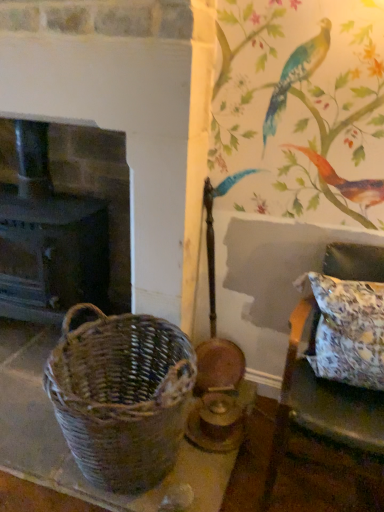
Question: Is woven brown picnic basket at left to the left of dark brown wood fireplace at left from the viewer's perspective?

Choices:
 (A) yes
 (B) no

Answer: (B)

Question: Is woven brown picnic basket at left facing away from dark brown wood fireplace at left?

Choices:
 (A) no
 (B) yes

Answer: (A)

Question: Is woven brown picnic basket at left taller than dark brown wood fireplace at left?

Choices:
 (A) yes
 (B) no

Answer: (B)

Question: Can we say woven brown picnic basket at left lies outside dark brown wood fireplace at left?

Choices:
 (A) no
 (B) yes

Answer: (B)

Question: Is woven brown picnic basket at left wider than dark brown wood fireplace at left?

Choices:
 (A) yes
 (B) no

Answer: (A)

Question: Considering the positions of point (382, 432) and point (377, 375), is point (382, 432) closer or farther from the camera than point (377, 375)?

Choices:
 (A) farther
 (B) closer

Answer: (B)

Question: From the image's perspective, is floral fabric cushion at right positioned above or below floral fabric pillow at right?

Choices:
 (A) above
 (B) below

Answer: (B)

Question: Do you think floral fabric cushion at right is within floral fabric pillow at right, or outside of it?

Choices:
 (A) outside
 (B) inside

Answer: (A)

Question: Considering their positions, is floral fabric cushion at right located in front of or behind floral fabric pillow at right?

Choices:
 (A) front
 (B) behind

Answer: (A)

Question: Considering the positions of point (112, 470) and point (261, 501), is point (112, 470) closer or farther from the camera than point (261, 501)?

Choices:
 (A) farther
 (B) closer

Answer: (B)

Question: From the image's perspective, relative to floral fabric cushion at right, is woven brown picnic basket at left above or below?

Choices:
 (A) below
 (B) above

Answer: (A)

Question: Choose the correct answer: Is woven brown picnic basket at left inside floral fabric cushion at right or outside it?

Choices:
 (A) outside
 (B) inside

Answer: (A)

Question: From a real-world perspective, is woven brown picnic basket at left physically located above or below floral fabric cushion at right?

Choices:
 (A) below
 (B) above

Answer: (A)

Question: From the image's perspective, is dark brown wood fireplace at left above or below floral fabric pillow at right?

Choices:
 (A) above
 (B) below

Answer: (A)

Question: In the image, is dark brown wood fireplace at left positioned in front of or behind floral fabric pillow at right?

Choices:
 (A) behind
 (B) front

Answer: (A)